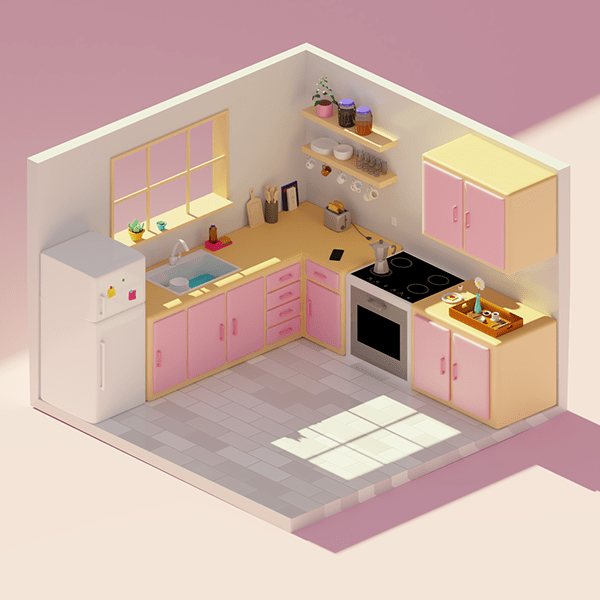
Locate an element on the screen. The width and height of the screenshot is (600, 600). slices of bread in toaster is located at coordinates (330, 205), (339, 207).